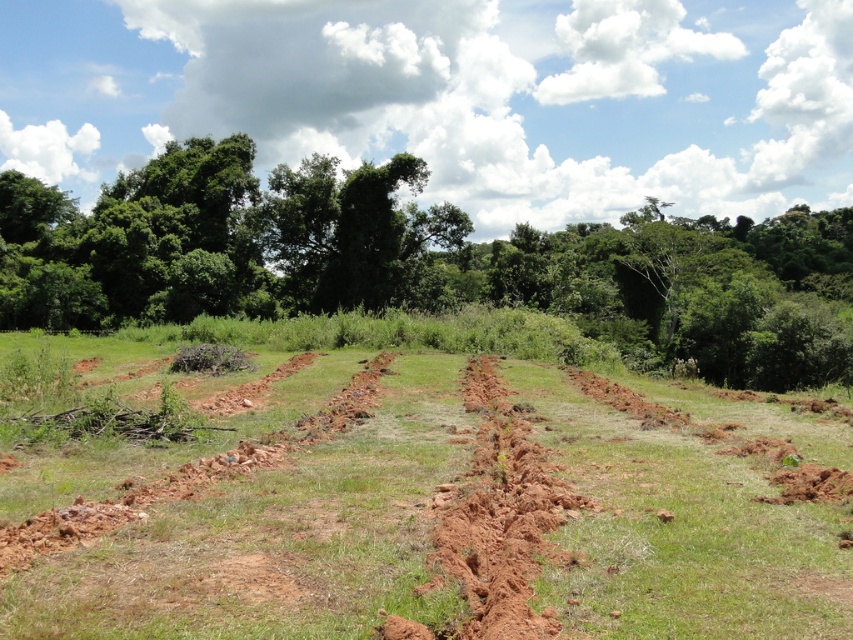
How much distance is there between brown soil at center and green leafy tree at center?

A distance of 189.06 feet exists between brown soil at center and green leafy tree at center.

Is point (32, 592) positioned before point (440, 204)?

That is True.

Locate an element on the screen. The image size is (853, 640). brown soil at center is located at coordinates (277, 536).